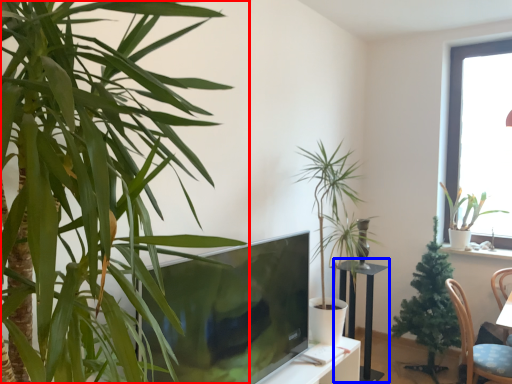
Question: Which object appears farthest to the camera in this image, houseplant (highlighted by a red box) or round table (highlighted by a blue box)?

Choices:
 (A) houseplant
 (B) round table

Answer: (B)